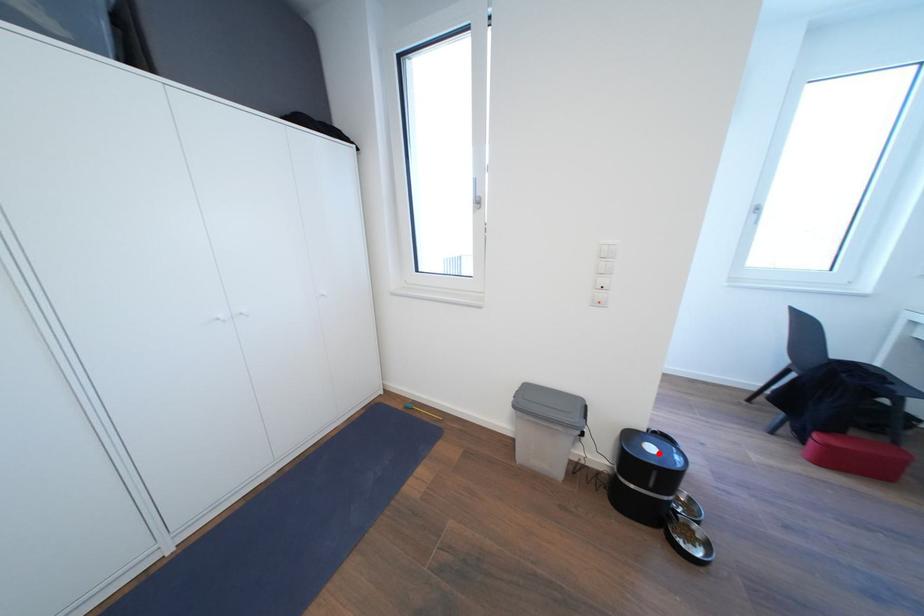
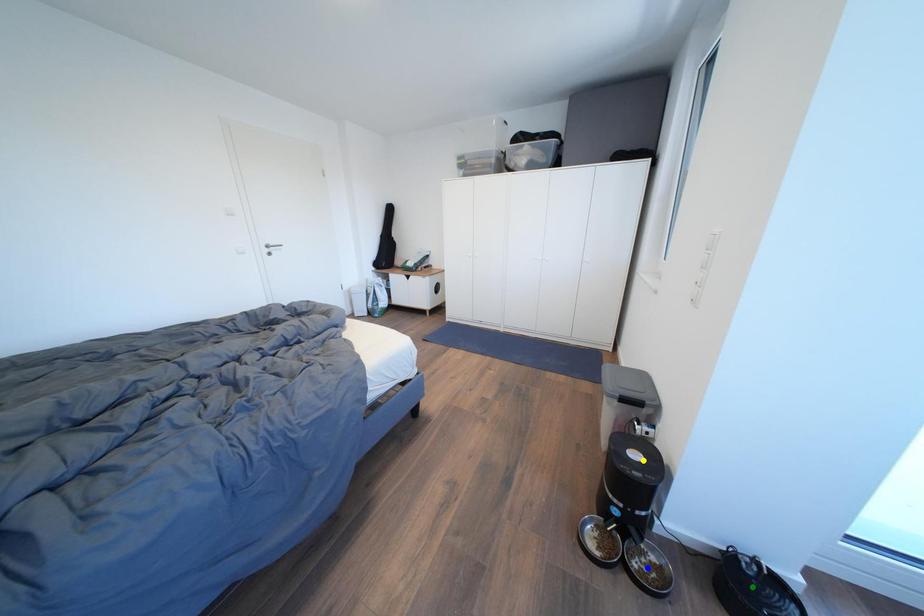
Question: I am providing you with two images of the same scene from different viewpoints. A red point is marked on the first image. You are given multiple points on the second image. Which point in image 2 is actually the same real-world point as the red point in image 1?

Choices:
 (A) blue point
 (B) green point
 (C) yellow point

Answer: (C)